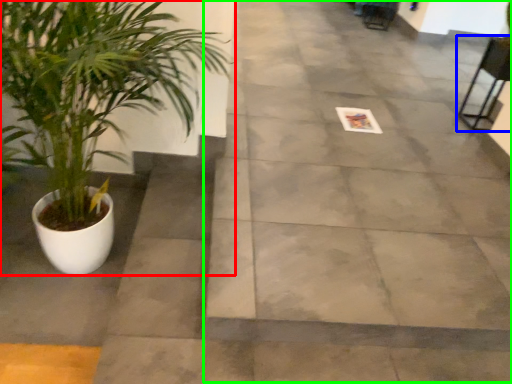
Question: Which object is positioned closest to houseplant (highlighted by a red box)? Select from chair (highlighted by a blue box) and pavement (highlighted by a green box).

Choices:
 (A) chair
 (B) pavement

Answer: (B)